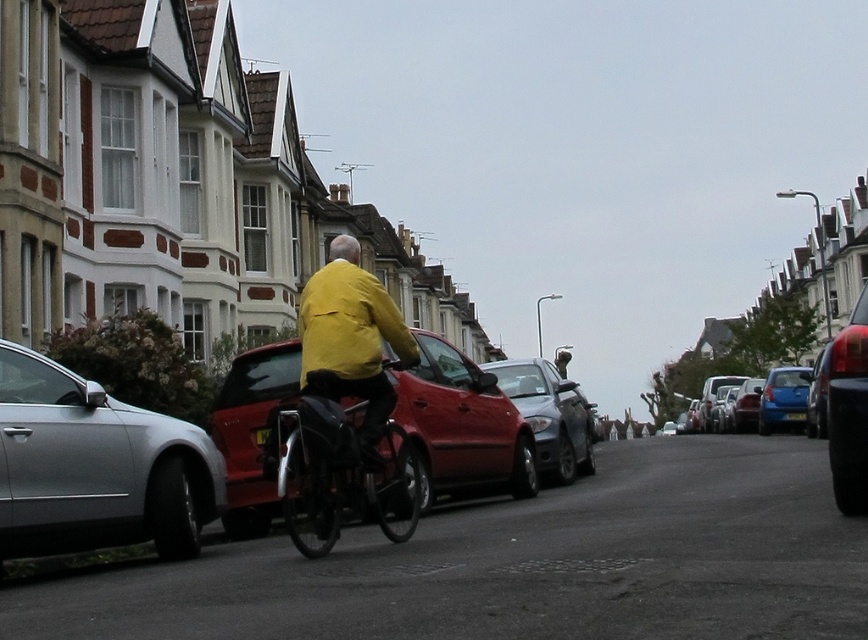
Question: Can you confirm if shiny blue sedan at right is thinner than metallic silver sedan at center right?

Choices:
 (A) yes
 (B) no

Answer: (B)

Question: Which of the following is the closest to the observer?

Choices:
 (A) (396, 308)
 (B) (812, 388)
 (C) (799, 388)
 (D) (792, 412)

Answer: (A)

Question: Which object appears closest to the camera in this image?

Choices:
 (A) metallic silver sedan at center right
 (B) yellow matte jacket at center
 (C) metallic silver bicycle at center
 (D) blue metallic hatchback at right

Answer: (C)

Question: Can you confirm if silver metallic sedan at left is positioned to the right of shiny metallic sedan at center?

Choices:
 (A) yes
 (B) no

Answer: (B)

Question: Which point is closer to the camera?

Choices:
 (A) (262, 444)
 (B) (783, 412)
 (C) (479, 396)
 (D) (0, 572)

Answer: (D)

Question: Does silver metallic sedan at left appear under metallic silver sedan at center right?

Choices:
 (A) no
 (B) yes

Answer: (A)